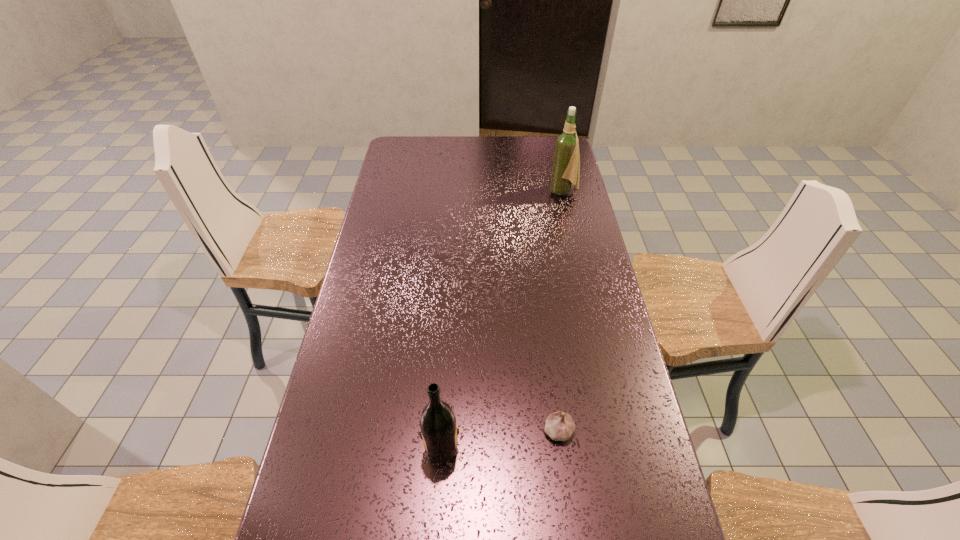
Find the location of a particular element. This screenshot has height=540, width=960. free space between the garlic and the right wine bottle is located at coordinates (561, 311).

This screenshot has height=540, width=960. What are the coordinates of `free area in between the second shortest object and the taller wine bottle` in the screenshot? It's located at (501, 319).

Locate an element on the screen. vacant area between the rightmost object and the nearer wine bottle is located at coordinates (501, 319).

Where is `empty location between the farthest object and the shortest object`? empty location between the farthest object and the shortest object is located at coordinates (561, 311).

Find the location of a particular element. This screenshot has width=960, height=540. free point between the shortest object and the taller wine bottle is located at coordinates (561, 311).

Locate which object is the second closest to the right wine bottle. Please provide its 2D coordinates. Your answer should be formatted as a tuple, i.e. [(x, y)], where the tuple contains the x and y coordinates of a point satisfying the conditions above.

[(438, 426)]

Identify which object is the second closest to the taller wine bottle. Please provide its 2D coordinates. Your answer should be formatted as a tuple, i.e. [(x, y)], where the tuple contains the x and y coordinates of a point satisfying the conditions above.

[(438, 426)]

The width and height of the screenshot is (960, 540). Identify the location of vacant position in the image that satisfies the following two spatial constraints: 1. on the front-facing side of the farther wine bottle; 2. on the front side of the left wine bottle. (620, 445).